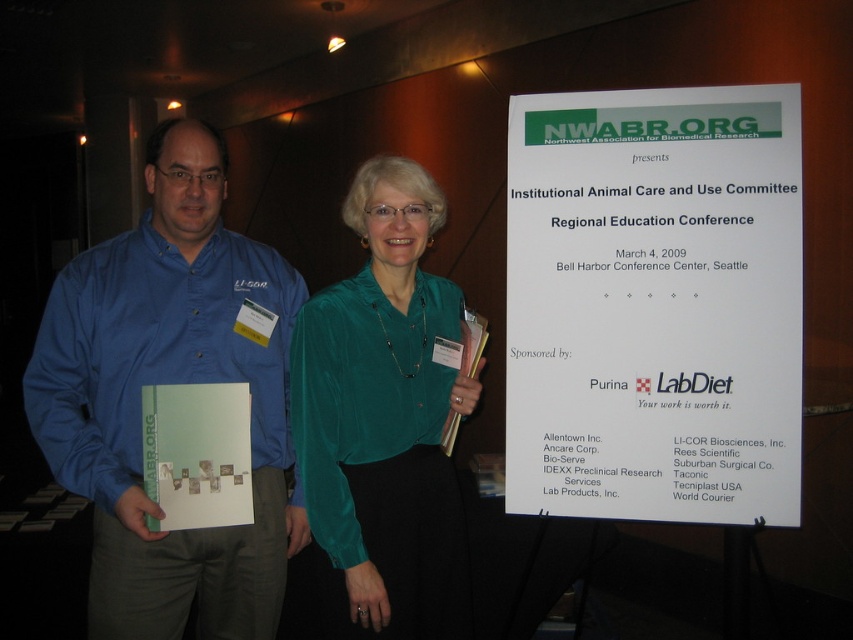
Is blue shirt at left above emerald satin blouse at center?

Yes, blue shirt at left is above emerald satin blouse at center.

Between blue shirt at left and emerald satin blouse at center, which one appears on the left side from the viewer's perspective?

Positioned to the left is blue shirt at left.

Which is in front, point (256, 372) or point (370, 316)?

Point (370, 316)

This screenshot has height=640, width=853. In order to click on blue shirt at left in this screenshot , I will do `click(170, 381)`.